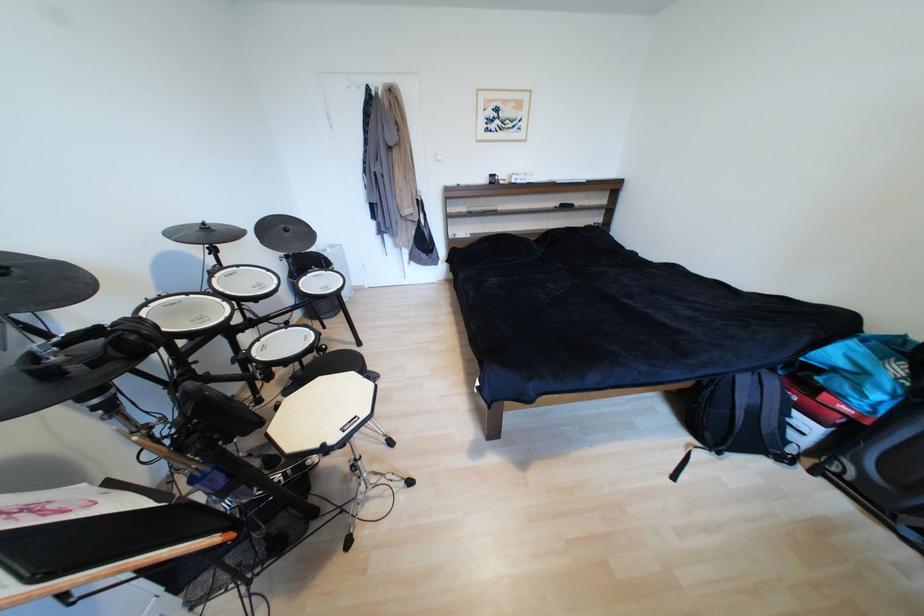
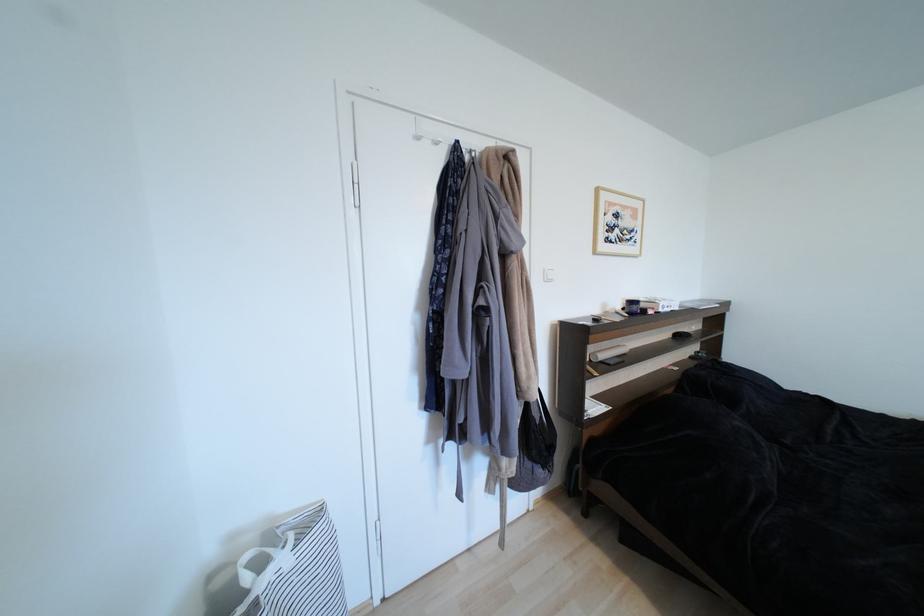
The point at (x=504, y=111) is marked in the first image. Where is the corresponding point in the second image?

(623, 217)